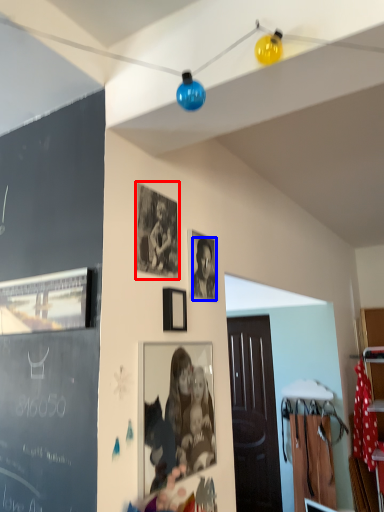
Question: Which of the following is the farthest to the observer, picture frame (highlighted by a red box) or person (highlighted by a blue box)?

Choices:
 (A) picture frame
 (B) person

Answer: (B)